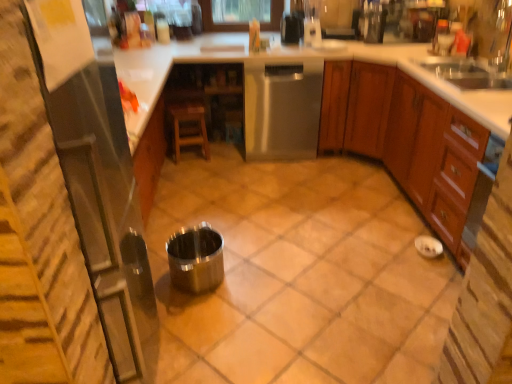
I want to click on vacant space to the right of wooden stool at center, so click(x=223, y=160).